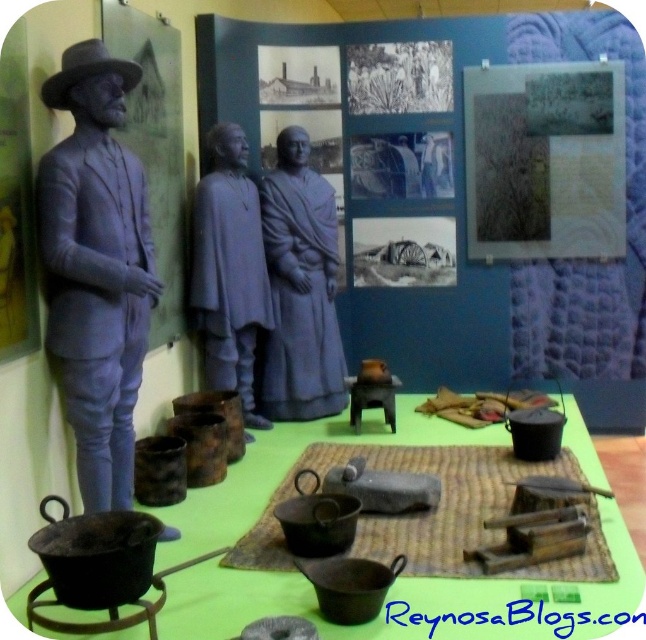
Question: Is matte gray statue at left bigger than gray matte statues at center?

Choices:
 (A) yes
 (B) no

Answer: (B)

Question: Is gray matte statue at center wider than gray matte statues at center?

Choices:
 (A) yes
 (B) no

Answer: (A)

Question: Which is nearer to the matte gray statue at left?

Choices:
 (A) gray matte statue at center
 (B) woven mat at center

Answer: (B)

Question: Among these points, which one is nearest to the camera?

Choices:
 (A) (76, 168)
 (B) (255, 228)
 (C) (441, 524)

Answer: (A)

Question: Can you confirm if matte gray statue at left is positioned above woven mat at center?

Choices:
 (A) no
 (B) yes

Answer: (B)

Question: Which point is farther to the camera?

Choices:
 (A) (492, 504)
 (B) (59, 282)

Answer: (A)